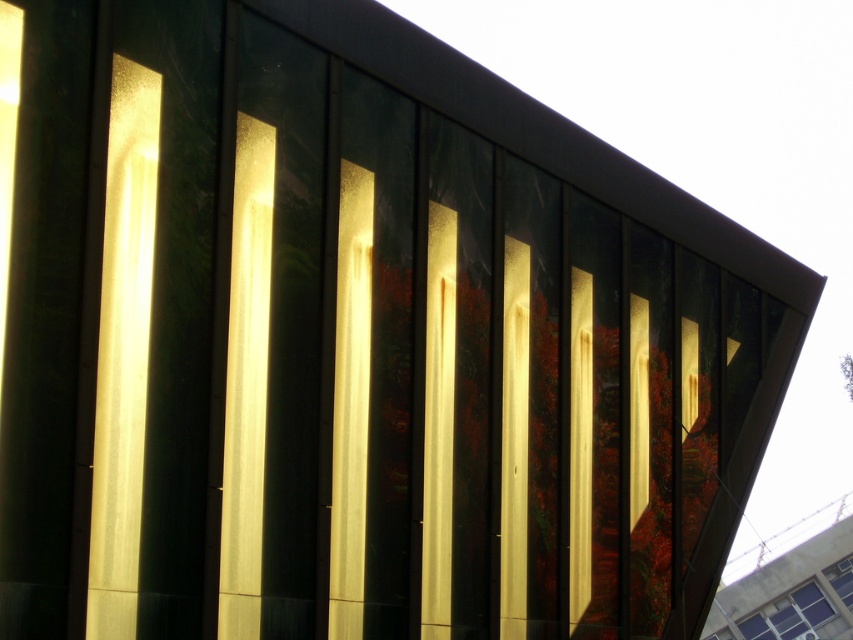
You are standing in front of the modern architectural structure and notice two windows at the lower right corner. Which one is positioned to the left between the clear glass window at lower right and the transparent glass window at lower right?

The clear glass window at lower right is positioned to the left of the transparent glass window at lower right.

You are an interior designer assessing the lighting in the building. You observe the clear glass window at lower right and the transparent glass window at lower right. Which window allows more natural light into the room?

The clear glass window at lower right allows more natural light into the room because it is larger in size than the transparent glass window at lower right.

You are standing in front of the modern architectural structure shown in the scene. You notice a clear glass window at lower right. Can you determine its exact position using the coordinate system provided?

The clear glass window at lower right is located at point (x=788, y=616) according to the coordinate system provided.